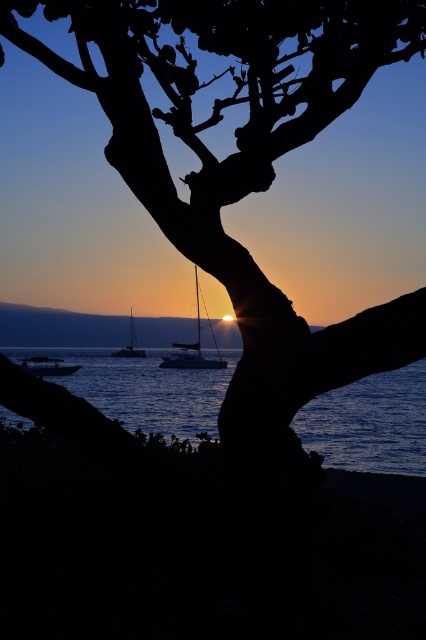
Question: Is metallic silver boat at lower left bigger than white glossy sailboat at center?

Choices:
 (A) no
 (B) yes

Answer: (B)

Question: Among these points, which one is farthest from the camera?

Choices:
 (A) (85, 54)
 (B) (68, 371)

Answer: (B)

Question: Can you confirm if silhouette bark tree at center is bigger than white glossy sailboat at center?

Choices:
 (A) yes
 (B) no

Answer: (B)

Question: Does shiny silver sailboat at center appear over white glossy sailboat at center?

Choices:
 (A) no
 (B) yes

Answer: (B)

Question: Which of the following is the closest to the observer?

Choices:
 (A) (178, 403)
 (B) (60, 365)
 (C) (198, 288)
 (D) (124, 346)

Answer: (A)

Question: Which point is closer to the camera taking this photo?

Choices:
 (A) (34, 372)
 (B) (255, 276)
 (C) (385, 380)

Answer: (B)